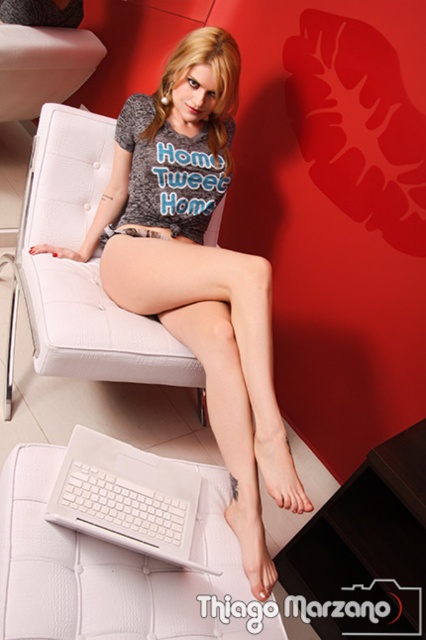
Question: Does white leather armchair at center appear over white plastic laptop at lower center?

Choices:
 (A) yes
 (B) no

Answer: (A)

Question: Which object is the farthest from the white matte keyboard at lower center?

Choices:
 (A) matte gray t-shirt at center
 (B) white leather daybed at center

Answer: (A)

Question: Which of the following is the closest to the observer?

Choices:
 (A) white leather daybed at center
 (B) matte gray t-shirt at center

Answer: (A)

Question: Observing the image, what is the correct spatial positioning of white leather daybed at center in reference to white matte keyboard at lower center?

Choices:
 (A) above
 (B) below

Answer: (B)

Question: Does white leather armchair at center lie in front of white plastic laptop at lower center?

Choices:
 (A) yes
 (B) no

Answer: (B)

Question: Which is farther from the white leather daybed at center?

Choices:
 (A) white leather armchair at center
 (B) white matte keyboard at lower center
 (C) matte gray t-shirt at center
 (D) white plastic laptop at lower center

Answer: (A)